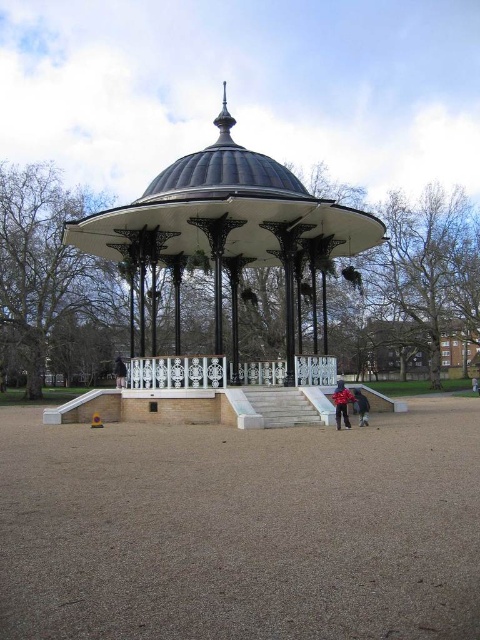
Question: In this image, where is white painted metal gazebo at center located relative to black fabric at lower center?

Choices:
 (A) left
 (B) right

Answer: (B)

Question: Is the position of red fabric jacket at center less distant than that of black fabric at lower center?

Choices:
 (A) yes
 (B) no

Answer: (A)

Question: Which point is closer to the camera taking this photo?

Choices:
 (A) click(192, 209)
 (B) click(118, 385)
 (C) click(340, 388)

Answer: (C)

Question: Among these objects, which one is farthest from the camera?

Choices:
 (A) black fabric at lower center
 (B) red jacket at lower center
 (C) white painted metal gazebo at center
 (D) red fabric jacket at center

Answer: (A)

Question: Which of these objects is positioned closest to the white painted metal gazebo at center?

Choices:
 (A) red jacket at lower center
 (B) red fabric jacket at center

Answer: (B)

Question: Is red fabric jacket at center bigger than black fabric at lower center?

Choices:
 (A) no
 (B) yes

Answer: (A)